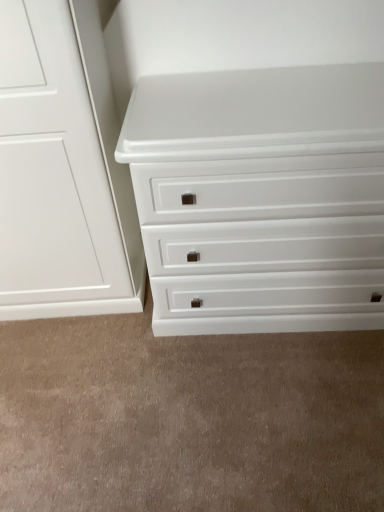
Question: Considering the relative positions of white glossy chest of drawers at center and white matte drawer at lower center in the image provided, is white glossy chest of drawers at center to the left or to the right of white matte drawer at lower center?

Choices:
 (A) left
 (B) right

Answer: (B)

Question: In the image, is white glossy chest of drawers at center positioned in front of or behind white matte drawer at lower center?

Choices:
 (A) behind
 (B) front

Answer: (B)

Question: From a real-world perspective, is white glossy chest of drawers at center positioned above or below white matte drawer at lower center?

Choices:
 (A) above
 (B) below

Answer: (A)

Question: Considering the positions of point [49, 333] and point [281, 132], is point [49, 333] closer or farther from the camera than point [281, 132]?

Choices:
 (A) closer
 (B) farther

Answer: (B)

Question: From the image's perspective, is white matte drawer at lower center located above or below white glossy chest of drawers at center?

Choices:
 (A) below
 (B) above

Answer: (A)

Question: From a real-world perspective, is white matte drawer at lower center above or below white glossy chest of drawers at center?

Choices:
 (A) below
 (B) above

Answer: (A)

Question: Is white matte drawer at lower center bigger or smaller than white glossy chest of drawers at center?

Choices:
 (A) small
 (B) big

Answer: (A)